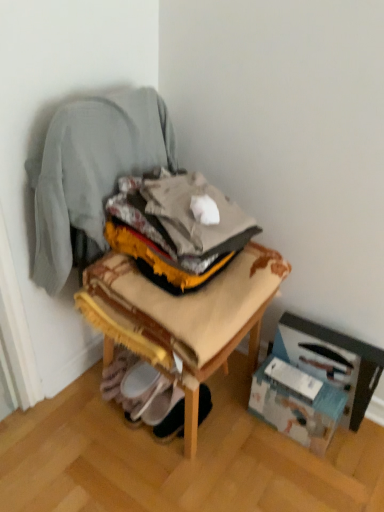
Image resolution: width=384 pixels, height=512 pixels. What are the coordinates of `vacant space in front of white fabric shoe at lower center` in the screenshot? It's located at (188, 467).